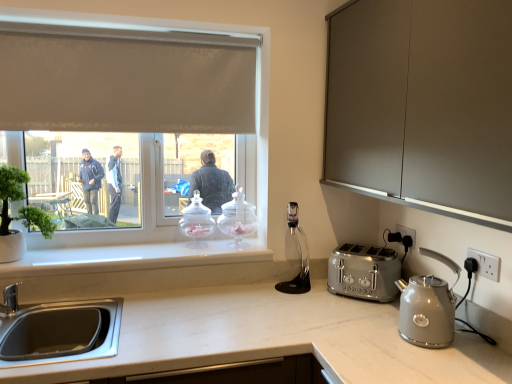
Where is `vacant space in clear glass jar at window, the 2th kitchen appliance when ordered from right to left (from a real-world perspective)`? vacant space in clear glass jar at window, the 2th kitchen appliance when ordered from right to left (from a real-world perspective) is located at coordinates (241, 246).